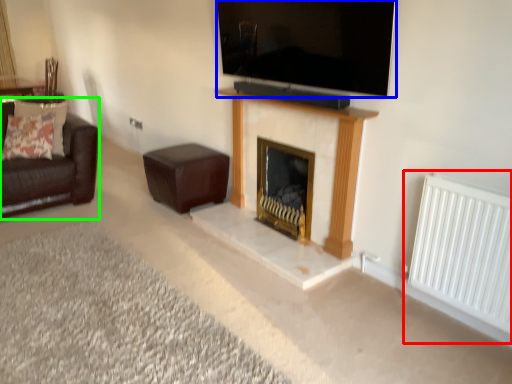
Question: Considering the real-world distances, which object is closest to radiator (highlighted by a red box)? television (highlighted by a blue box) or studio couch (highlighted by a green box).

Choices:
 (A) television
 (B) studio couch

Answer: (A)